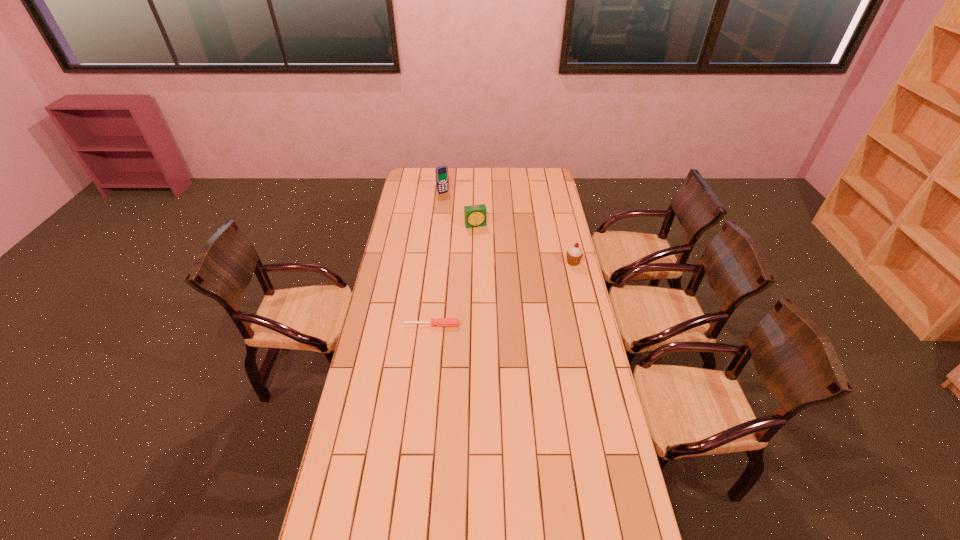
In order to click on the nearest object in this screenshot , I will do `click(440, 322)`.

The image size is (960, 540). In order to click on the shortest object in this screenshot , I will do `click(440, 322)`.

At what (x,y) coordinates should I click in order to perform the action: click on the second nearest object. Please return your answer as a coordinate pair (x, y). Looking at the image, I should click on (574, 254).

At what (x,y) coordinates should I click in order to perform the action: click on cupcake. Please return your answer as a coordinate pair (x, y). Looking at the image, I should click on pos(574,254).

Locate an element on the screen. The height and width of the screenshot is (540, 960). alarm clock is located at coordinates (474, 215).

You are a GUI agent. You are given a task and a screenshot of the screen. Output one action in this format:
    pyautogui.click(x=<x>, y=<y>)
    Task: Click on the third object from left to right
    The width and height of the screenshot is (960, 540).
    Given the screenshot: What is the action you would take?
    pyautogui.click(x=474, y=215)

The width and height of the screenshot is (960, 540). I want to click on cellular telephone, so click(x=442, y=180).

Locate an element on the screen. The image size is (960, 540). the tallest object is located at coordinates (442, 180).

What are the coordinates of `free space located 0.150m at the tip of the shortest object` in the screenshot? It's located at (429, 356).

You are a GUI agent. You are given a task and a screenshot of the screen. Output one action in this format:
    pyautogui.click(x=<x>, y=<y>)
    Task: Click on the vacant space situated 0.240m on the front of the cupcake
    The image size is (960, 540).
    Given the screenshot: What is the action you would take?
    pyautogui.click(x=583, y=303)